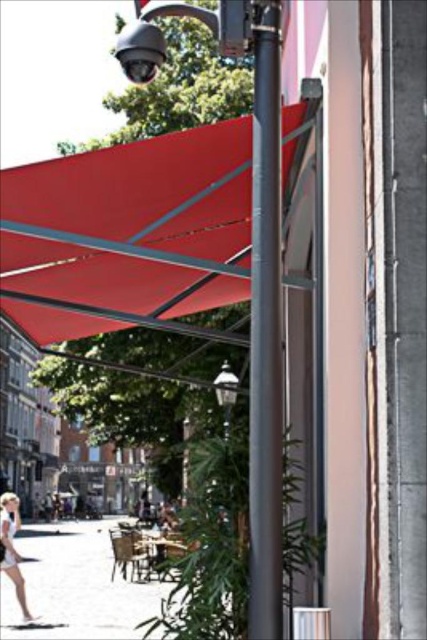
Can you confirm if smooth gray pole at center is taller than white cotton dress at lower left?

Correct, smooth gray pole at center is much taller as white cotton dress at lower left.

In the scene shown: Is smooth gray pole at center to the left of white cotton dress at lower left from the viewer's perspective?

In fact, smooth gray pole at center is to the right of white cotton dress at lower left.

Is point (274, 244) positioned behind point (17, 524)?

No, (274, 244) is in front of (17, 524).

Locate an element on the screen. smooth gray pole at center is located at coordinates (265, 332).

Between smooth concrete pavement at lower left and white cotton dress at lower left, which one has less height?

white cotton dress at lower left is shorter.

Does smooth concrete pavement at lower left have a greater width compared to white cotton dress at lower left?

Yes.

Which is behind, point (78, 628) or point (20, 579)?

The point (20, 579) is more distant.

Where is `smooth concrete pavement at lower left`? The width and height of the screenshot is (427, 640). smooth concrete pavement at lower left is located at coordinates (76, 584).

Is point (284, 115) positioned before point (40, 614)?

That is True.

Is matte red awning at center below smooth concrete pavement at lower left?

Incorrect, matte red awning at center is not positioned below smooth concrete pavement at lower left.

Is point (26, 291) farther from camera compared to point (69, 529)?

No, (26, 291) is closer to viewer.

Where is `matte red awning at center`? matte red awning at center is located at coordinates (128, 232).